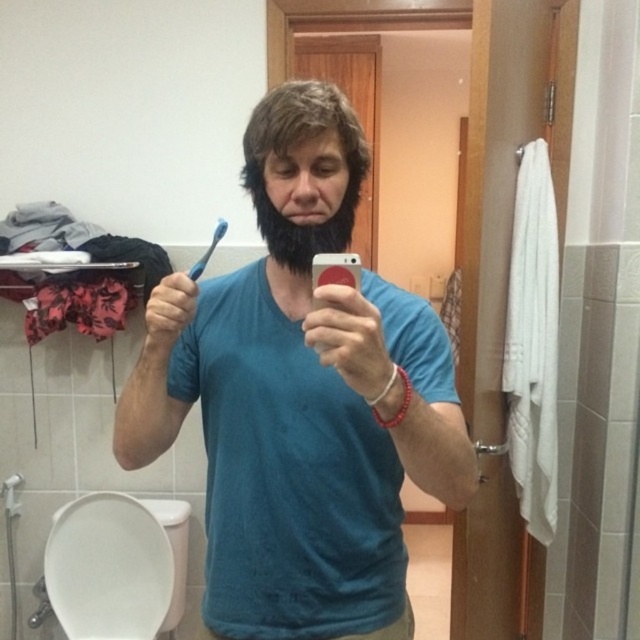
From the picture: Does blue matte toothbrush at center appear on the left side of white glossy toilet bowl at lower left?

No, blue matte toothbrush at center is not to the left of white glossy toilet bowl at lower left.

Is point (304, 412) farther from camera compared to point (83, 600)?

No.

Identify the location of blue matte toothbrush at center. The height and width of the screenshot is (640, 640). (301, 397).

Who is more distant from viewer, (356, 204) or (214, 237)?

The point (214, 237) is behind.

Identify the location of black fuzzy beard at center. The width and height of the screenshot is (640, 640). (300, 225).

Does white glossy toilet bowl at lower left have a lesser width compared to blue plastic toothbrush at upper center?

In fact, white glossy toilet bowl at lower left might be wider than blue plastic toothbrush at upper center.

Which is more to the right, white glossy toilet bowl at lower left or blue plastic toothbrush at upper center?

blue plastic toothbrush at upper center is more to the right.

Does point (109, 634) lie behind point (224, 234)?

No, it is in front of (224, 234).

Where is `white glossy toilet bowl at lower left`? Image resolution: width=640 pixels, height=640 pixels. white glossy toilet bowl at lower left is located at coordinates (116, 564).